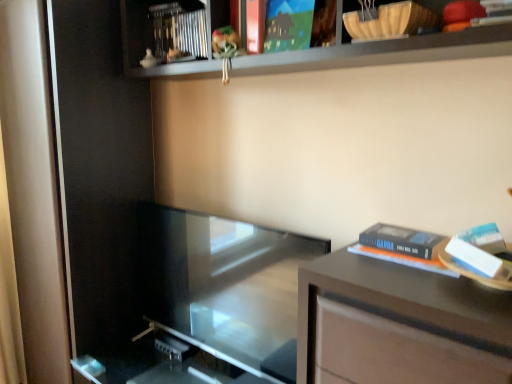
Question: Is matte paper at upper center, the first paperback book viewed from the left, not near hardcover book at right, which ranks as the 2th paperback book in left-to-right order?

Choices:
 (A) yes
 (B) no

Answer: (B)

Question: Can we say matte paper at upper center, the first paperback book when ordered from top to bottom, lies outside hardcover book at right, the 1th paperback book viewed from the right?

Choices:
 (A) no
 (B) yes

Answer: (B)

Question: From a real-world perspective, is matte paper at upper center, which ranks as the second paperback book in right-to-left order, under hardcover book at right, the 1th paperback book ordered from the bottom?

Choices:
 (A) yes
 (B) no

Answer: (B)

Question: Is the depth of matte paper at upper center, the first paperback book viewed from the left, greater than that of hardcover book at right, the 1th paperback book viewed from the right?

Choices:
 (A) no
 (B) yes

Answer: (B)

Question: Can you confirm if matte paper at upper center, positioned as the 2th paperback book in bottom-to-top order, is positioned to the left of hardcover book at right, which ranks as the 2th paperback book in left-to-right order?

Choices:
 (A) yes
 (B) no

Answer: (A)

Question: Can you confirm if matte paper at upper center, the first paperback book viewed from the left, is wider than hardcover book at right, which ranks as the 2th paperback book in left-to-right order?

Choices:
 (A) yes
 (B) no

Answer: (B)

Question: Can matte white screen door at left, the first screen door positioned from the left, be found inside metallic silver book at upper center?

Choices:
 (A) yes
 (B) no

Answer: (B)

Question: From the image's perspective, is metallic silver book at upper center on matte white screen door at left, which is counted as the second screen door, starting from the right?

Choices:
 (A) no
 (B) yes

Answer: (B)

Question: Is metallic silver book at upper center behind matte white screen door at left, which is counted as the second screen door, starting from the right?

Choices:
 (A) no
 (B) yes

Answer: (A)

Question: Does metallic silver book at upper center turn towards matte white screen door at left, the first screen door positioned from the left?

Choices:
 (A) yes
 (B) no

Answer: (B)

Question: Considering the relative sizes of metallic silver book at upper center and matte white screen door at left, which is counted as the second screen door, starting from the right, in the image provided, is metallic silver book at upper center wider than matte white screen door at left, which is counted as the second screen door, starting from the right,?

Choices:
 (A) yes
 (B) no

Answer: (B)

Question: From the image's perspective, would you say metallic silver book at upper center is shown under matte white screen door at left, the first screen door positioned from the left?

Choices:
 (A) yes
 (B) no

Answer: (B)

Question: Is matte white screen door at left, the first screen door positioned from the left, next to hardcover book at right, the second paperback book when ordered from top to bottom?

Choices:
 (A) no
 (B) yes

Answer: (A)